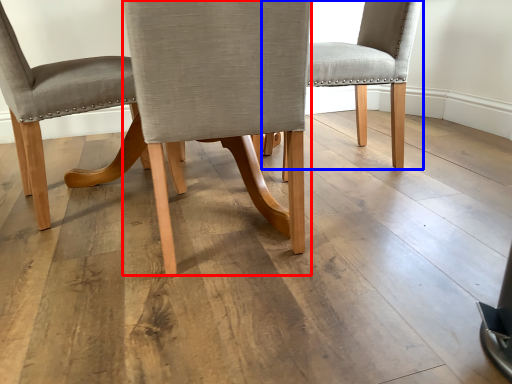
Question: Which object appears closest to the camera in this image, chair (highlighted by a red box) or chair (highlighted by a blue box)?

Choices:
 (A) chair
 (B) chair

Answer: (A)